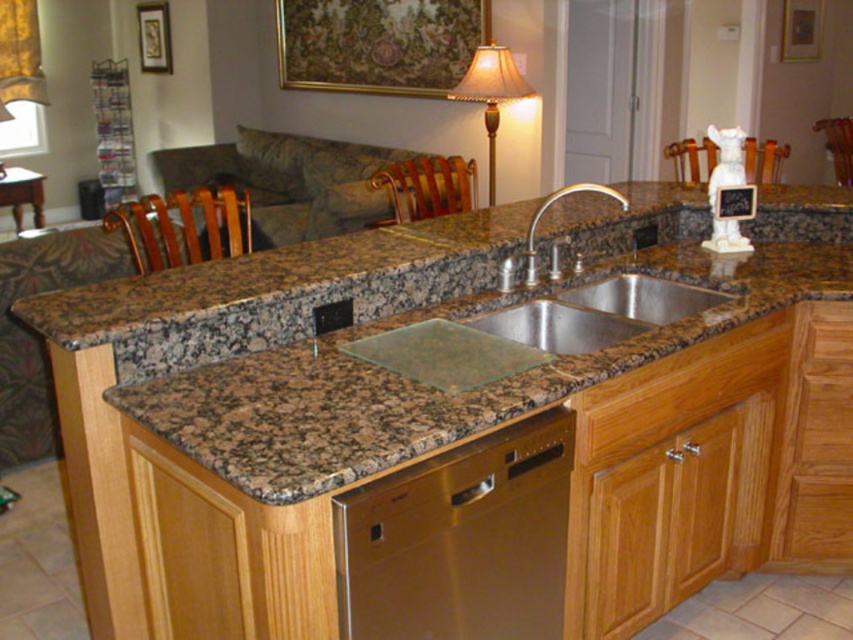
Is stainless steel sink at center smaller than brown wood chair at left?

Indeed, stainless steel sink at center has a smaller size compared to brown wood chair at left.

The image size is (853, 640). Describe the element at coordinates (596, 314) in the screenshot. I see `stainless steel sink at center` at that location.

This screenshot has width=853, height=640. Find the location of `stainless steel sink at center`. stainless steel sink at center is located at coordinates (596, 314).

Looking at this image, can you confirm if wooden drawer at lower center is bigger than wooden chair at right?

No, wooden drawer at lower center is not bigger than wooden chair at right.

Between wooden drawer at lower center and wooden chair at right, which one has less height?

wooden drawer at lower center

This screenshot has height=640, width=853. Describe the element at coordinates (680, 388) in the screenshot. I see `wooden drawer at lower center` at that location.

The width and height of the screenshot is (853, 640). In order to click on wooden drawer at lower center in this screenshot , I will do `click(680, 388)`.

I want to click on gold metallic faucet at center, so click(544, 211).

Is point (608, 195) more distant than point (828, 116)?

No.

Which is behind, point (577, 189) or point (833, 125)?

Point (833, 125)

Where is `gold metallic faucet at center`? gold metallic faucet at center is located at coordinates (544, 211).